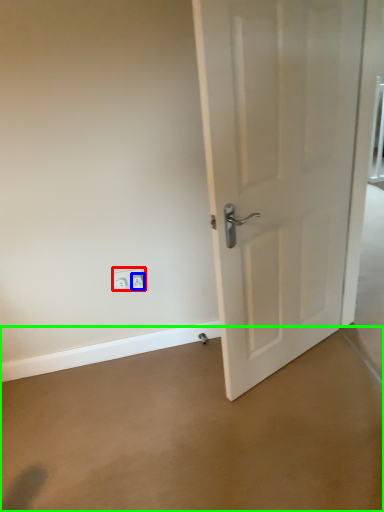
Question: Estimate the real-world distances between objects in this image. Which object is closer to electric outlet (highlighted by a red box), electric outlet (highlighted by a blue box) or concrete (highlighted by a green box)?

Choices:
 (A) electric outlet
 (B) concrete

Answer: (A)